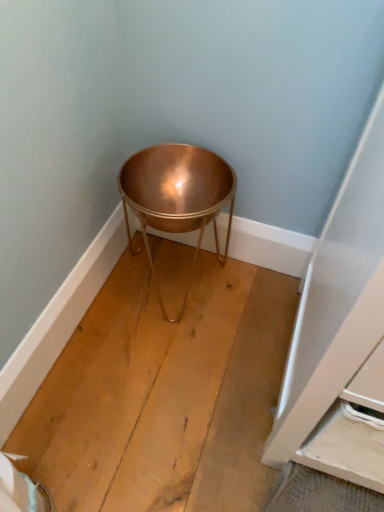
Question: Should I look upward or downward to see copper metallic bowl at center?

Choices:
 (A) down
 (B) up

Answer: (B)